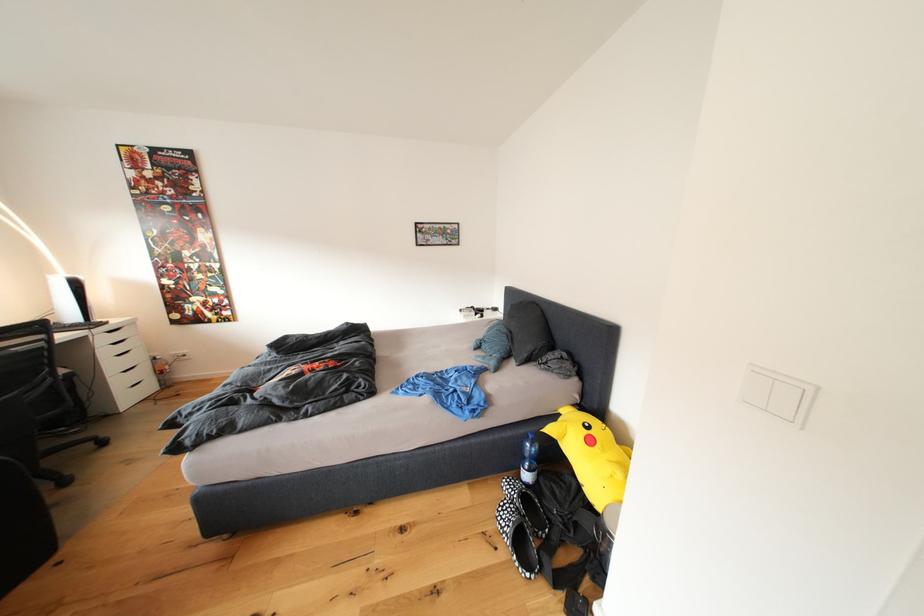
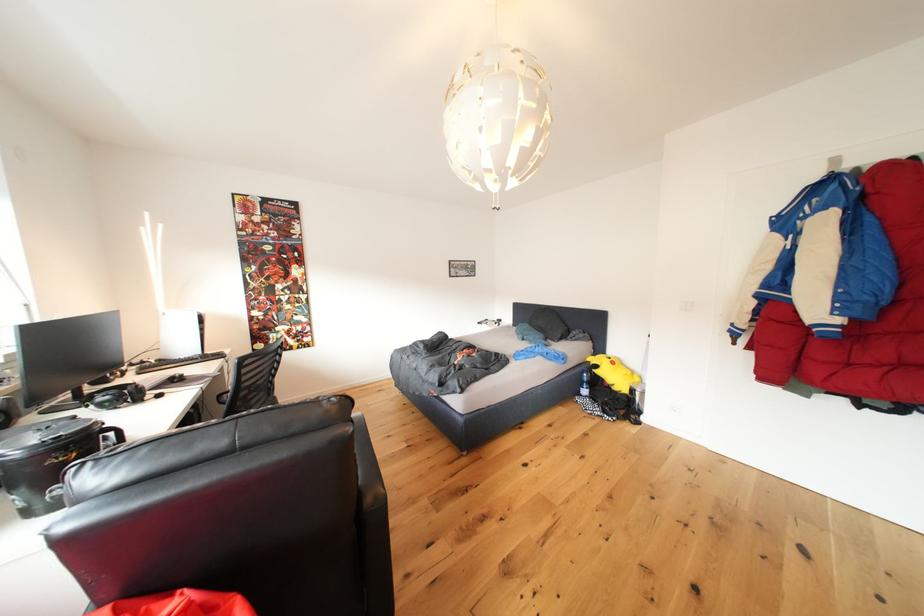
Consider the image. The images are taken continuously from a first-person perspective. In which direction are you moving?

The movement direction of the cameraman is left, backward.